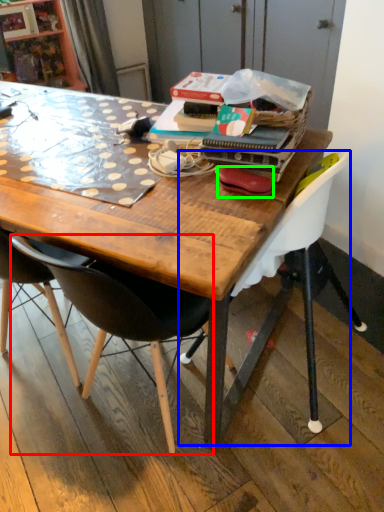
Question: Considering the real-world distances, which object is farthest from chair (highlighted by a red box)? chair (highlighted by a blue box) or handbag (highlighted by a green box)?

Choices:
 (A) chair
 (B) handbag

Answer: (B)